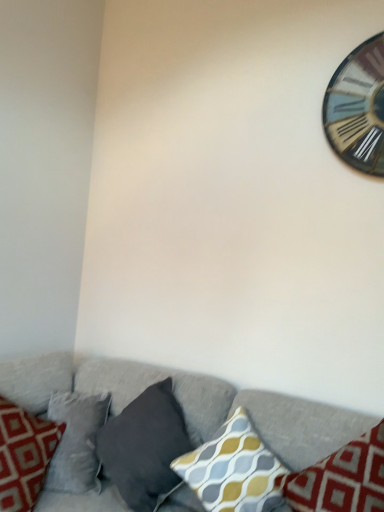
Question: In the image, is yellow-gray patterned pillow at lower right, which is the third pillow in left-to-right order, on the left side or the right side of dark gray fabric pillow at lower center, which ranks as the 3th pillow in right-to-left order?

Choices:
 (A) left
 (B) right

Answer: (B)

Question: From the image's perspective, is yellow-gray patterned pillow at lower right, which is the third pillow in left-to-right order, positioned above or below dark gray fabric pillow at lower center, arranged as the 1th pillow when viewed from the left?

Choices:
 (A) above
 (B) below

Answer: (B)

Question: Which of these objects is positioned farthest from the dark gray fabric pillow at lower center, arranged as the 1th pillow when viewed from the left?

Choices:
 (A) textured gray couch at lower center
 (B) yellow-gray patterned pillow at lower right, which is the third pillow in left-to-right order
 (C) yellow-gray patterned cushion at center, arranged as the second pillow when viewed from the left
 (D) wooden clock at upper right

Answer: (D)

Question: Which is farther from the yellow-gray patterned cushion at center, arranged as the second pillow when viewed from the left?

Choices:
 (A) textured gray couch at lower center
 (B) dark gray fabric pillow at lower center, which ranks as the 3th pillow in right-to-left order
 (C) wooden clock at upper right
 (D) yellow-gray patterned pillow at lower right, which is the third pillow in left-to-right order

Answer: (C)